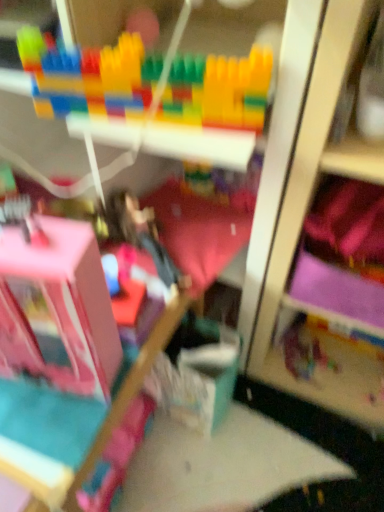
Question: Is translucent plastic toy at center, the third toy from the left, oriented away from pink fabric bedding at center?

Choices:
 (A) yes
 (B) no

Answer: (B)

Question: Is translucent plastic toy at center, acting as the 3th toy starting from the top, not within pink fabric bedding at center?

Choices:
 (A) yes
 (B) no

Answer: (A)

Question: Does translucent plastic toy at center, acting as the 3th toy starting from the top, have a smaller size compared to pink fabric bedding at center?

Choices:
 (A) yes
 (B) no

Answer: (A)

Question: Is translucent plastic toy at center, arranged as the 1th toy when ordered from the bottom, facing towards pink fabric bedding at center?

Choices:
 (A) yes
 (B) no

Answer: (B)

Question: Would you say pink fabric bedding at center is part of translucent plastic toy at center, the 3th toy when ordered from front to back,'s contents?

Choices:
 (A) no
 (B) yes

Answer: (A)

Question: Would you say pink fabric bed frame at lower left is to the left or to the right of pink fabric bedding at center in the picture?

Choices:
 (A) right
 (B) left

Answer: (B)

Question: Is point (84, 468) closer or farther from the camera than point (177, 262)?

Choices:
 (A) farther
 (B) closer

Answer: (B)

Question: From the image's perspective, is pink fabric bed frame at lower left located above or below pink fabric bedding at center?

Choices:
 (A) above
 (B) below

Answer: (B)

Question: In terms of width, does pink fabric bed frame at lower left look wider or thinner when compared to pink fabric bedding at center?

Choices:
 (A) thin
 (B) wide

Answer: (B)

Question: From the image's perspective, is multicolored plastic blocks at upper center, arranged as the 2th toy when viewed from the left, above or below translucent plastic toy at center, the 1th toy when ordered from back to front?

Choices:
 (A) above
 (B) below

Answer: (A)

Question: Considering the positions of multicolored plastic blocks at upper center, positioned as the 2th toy in front-to-back order, and translucent plastic toy at center, the 3th toy when ordered from front to back, in the image, is multicolored plastic blocks at upper center, positioned as the 2th toy in front-to-back order, taller or shorter than translucent plastic toy at center, the 3th toy when ordered from front to back,?

Choices:
 (A) tall
 (B) short

Answer: (A)

Question: In terms of width, does multicolored plastic blocks at upper center, positioned as the 2th toy in front-to-back order, look wider or thinner when compared to translucent plastic toy at center, the third toy from the left?

Choices:
 (A) wide
 (B) thin

Answer: (A)

Question: Does point (41, 111) appear closer or farther from the camera than point (324, 364)?

Choices:
 (A) closer
 (B) farther

Answer: (A)

Question: Is translucent plastic toy at center, arranged as the 1th toy when ordered from the bottom, to the left or to the right of pink fabric bed frame at lower left in the image?

Choices:
 (A) right
 (B) left

Answer: (A)

Question: From the image's perspective, relative to pink fabric bed frame at lower left, is translucent plastic toy at center, arranged as the 1th toy when ordered from the bottom, above or below?

Choices:
 (A) below
 (B) above

Answer: (A)